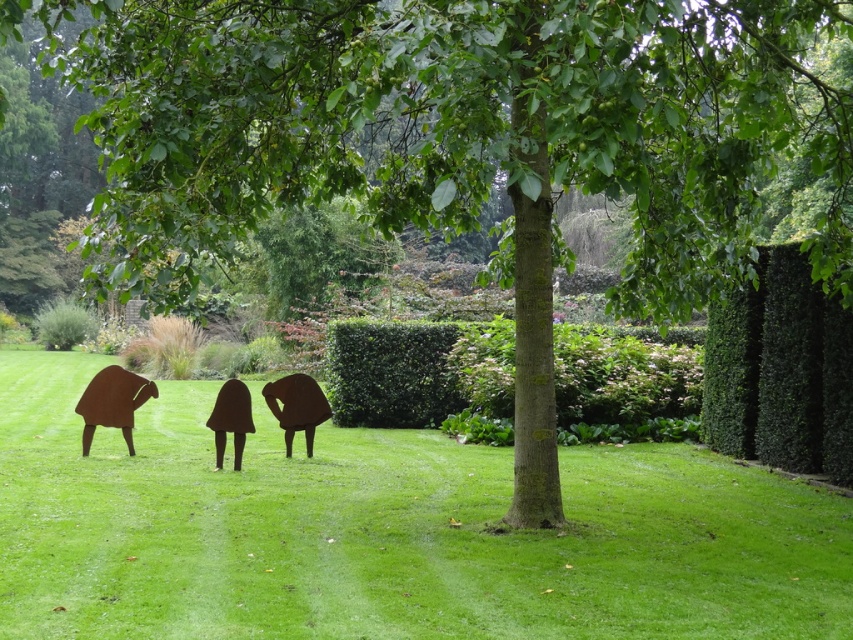
Which of these two, green leafy hedge at center or rusty metal sculpture at center, stands shorter?

green leafy hedge at center

Describe the element at coordinates (418, 371) in the screenshot. Image resolution: width=853 pixels, height=640 pixels. I see `green leafy hedge at center` at that location.

Find the location of a particular element. green leafy hedge at center is located at coordinates (418, 371).

Measure the distance between rusty metal figures at center and camera.

rusty metal figures at center and camera are 10.84 meters apart from each other.

Is rusty metal figures at center taller than rusty metal sculpture at lower left?

In fact, rusty metal figures at center may be shorter than rusty metal sculpture at lower left.

Locate an element on the screen. rusty metal figures at center is located at coordinates (112, 401).

Can you confirm if green leafy hedge at center is positioned to the right of green leafy hedge at right?

No, green leafy hedge at center is not to the right of green leafy hedge at right.

Is green leafy hedge at center taller than green leafy hedge at right?

No.

Locate an element on the screen. This screenshot has height=640, width=853. green leafy hedge at center is located at coordinates (418, 371).